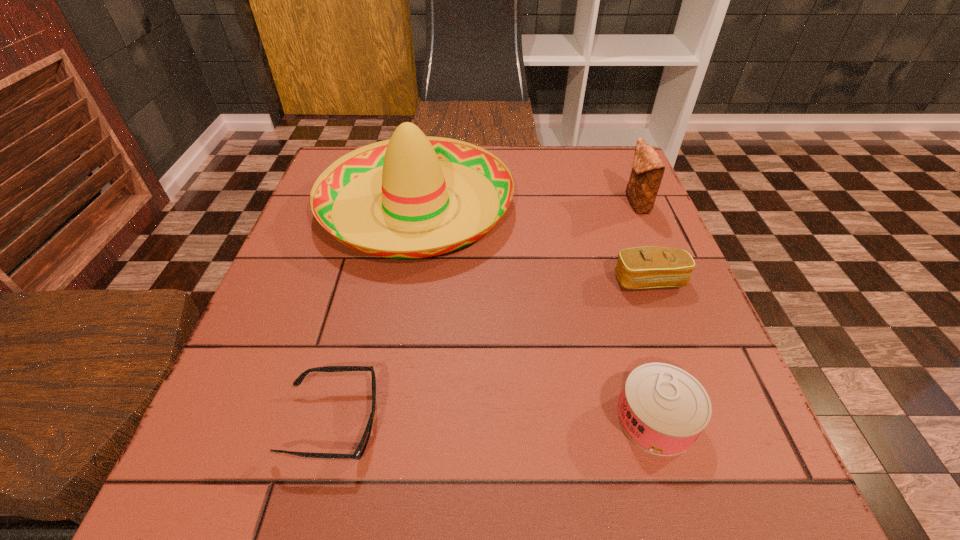
The width and height of the screenshot is (960, 540). I want to click on sombrero, so click(x=414, y=173).

You are a GUI agent. You are given a task and a screenshot of the screen. Output one action in this format:
    pyautogui.click(x=<x>, y=<y>)
    Task: Click on the fourth shortest object
    The width and height of the screenshot is (960, 540).
    Given the screenshot: What is the action you would take?
    pyautogui.click(x=647, y=172)

Locate an element on the screen. This screenshot has height=540, width=960. the taller clutch bag is located at coordinates (647, 172).

Image resolution: width=960 pixels, height=540 pixels. What are the coordinates of `the nearer clutch bag` in the screenshot? It's located at (651, 266).

The width and height of the screenshot is (960, 540). I want to click on can, so click(x=663, y=409).

Image resolution: width=960 pixels, height=540 pixels. In order to click on the shortest object in this screenshot , I will do `click(359, 452)`.

The image size is (960, 540). What are the coordinates of `vacant region located 0.360m on the front of the tallest object` in the screenshot? It's located at (374, 451).

You are a GUI agent. You are given a task and a screenshot of the screen. Output one action in this format:
    pyautogui.click(x=<x>, y=<y>)
    Task: Click on the free location located 0.340m on the open side of the second tallest object
    The image size is (960, 540).
    Given the screenshot: What is the action you would take?
    pyautogui.click(x=480, y=204)

Find the location of a particular element. free region located 0.340m on the open side of the second tallest object is located at coordinates (480, 204).

The width and height of the screenshot is (960, 540). I want to click on vacant space located on the open side of the second tallest object, so click(x=594, y=204).